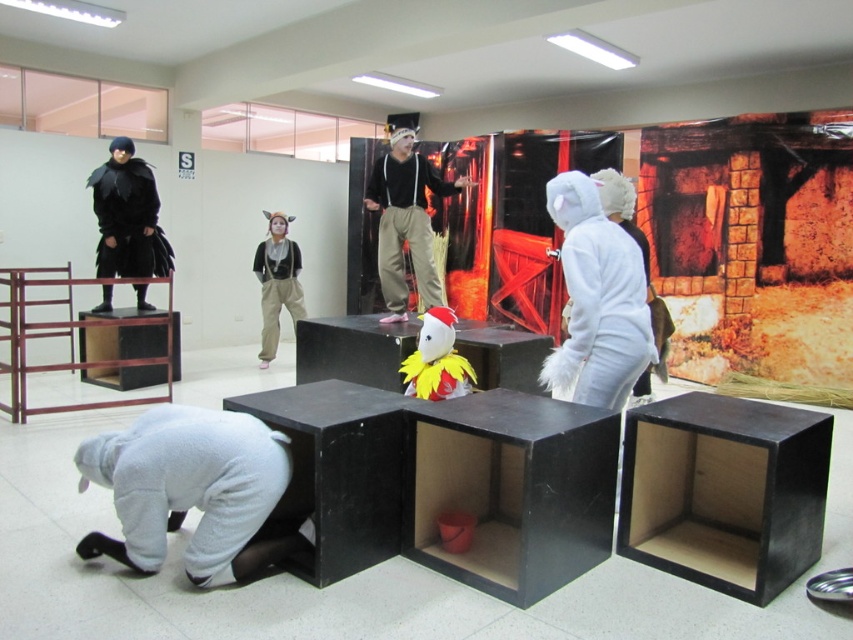
Is point (270, 512) closer to viewer compared to point (393, 154)?

Yes, point (270, 512) is in front of point (393, 154).

Is gray fleece costume at lower left positioned in front of matte black outfit at center?

That is True.

You are a GUI agent. You are given a task and a screenshot of the screen. Output one action in this format:
    pyautogui.click(x=<x>, y=<y>)
    Task: Click on the gray fleece costume at lower left
    
    Given the screenshot: What is the action you would take?
    pyautogui.click(x=192, y=492)

Is gray fleece costume at lower left in front of white furry costume at right?

Yes.

Does gray fleece costume at lower left come behind white furry costume at right?

No, it is not.

Where is `gray fleece costume at lower left`? gray fleece costume at lower left is located at coordinates (192, 492).

Is gray fleece costume at lower left to the left of black matte clothing at upper left from the viewer's perspective?

No, gray fleece costume at lower left is not to the left of black matte clothing at upper left.

Which is behind, point (114, 445) or point (148, 252)?

The point (148, 252) is behind.

What are the coordinates of `gray fleece costume at lower left` in the screenshot? It's located at (192, 492).

Find the location of a particular element. This screenshot has width=853, height=640. gray fleece costume at lower left is located at coordinates (192, 492).